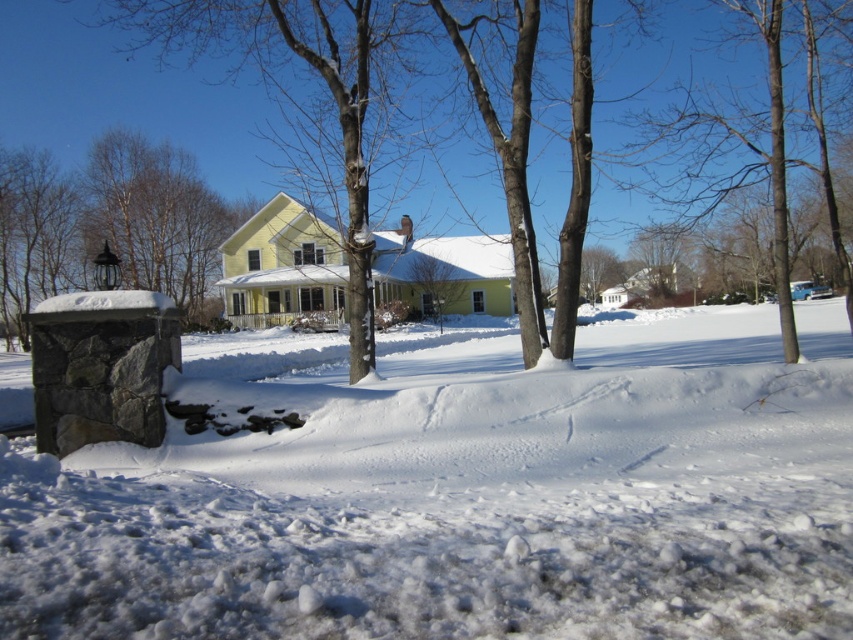
You are standing in front of the yellow house with a white roof. You see the white fluffy snow at lower center and the smooth gray stone post at left. Which object is closer to you?

The white fluffy snow at lower center is closer to you since it is in front of the smooth gray stone post at left.

You are standing in front of the yellow house with a white roof. There is a specific point marked at coordinates point (463,496). What is located at that point?

The white fluffy snow at lower center is located at point (463,496).